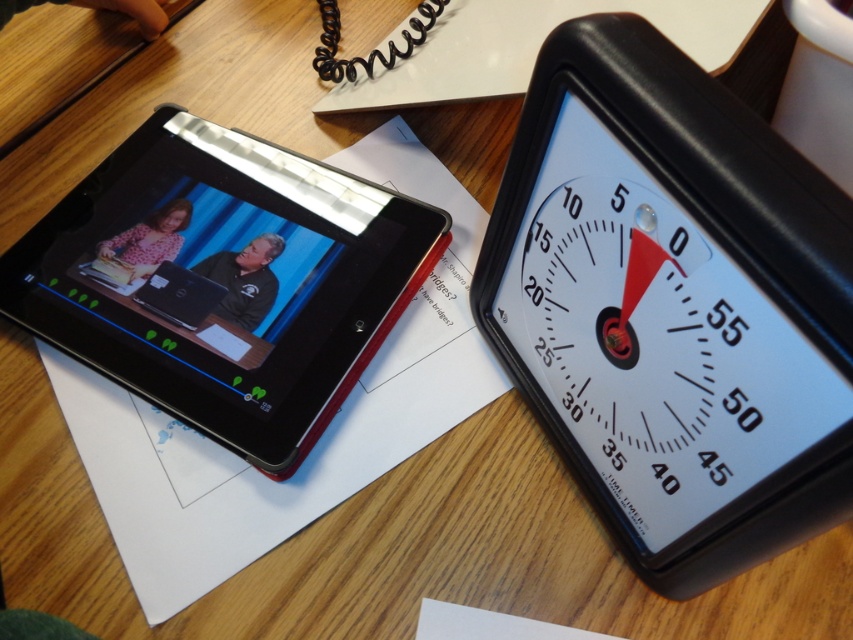
Which is more to the left, white plastic timer at upper right or black plastic tablet at left?

black plastic tablet at left is more to the left.

Who is positioned more to the right, white plastic timer at upper right or black plastic tablet at left?

Positioned to the right is white plastic timer at upper right.

Is point (671, 396) positioned after point (107, 374)?

That is False.

You are a GUI agent. You are given a task and a screenshot of the screen. Output one action in this format:
    pyautogui.click(x=<x>, y=<y>)
    Task: Click on the white plastic timer at upper right
    
    Given the screenshot: What is the action you would take?
    pyautogui.click(x=672, y=305)